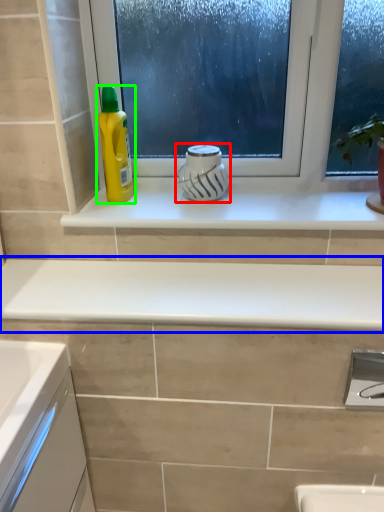
Question: Which is nearer to the appliance (highlighted by a red box)? countertop (highlighted by a blue box) or cleaning product (highlighted by a green box).

Choices:
 (A) countertop
 (B) cleaning product

Answer: (B)